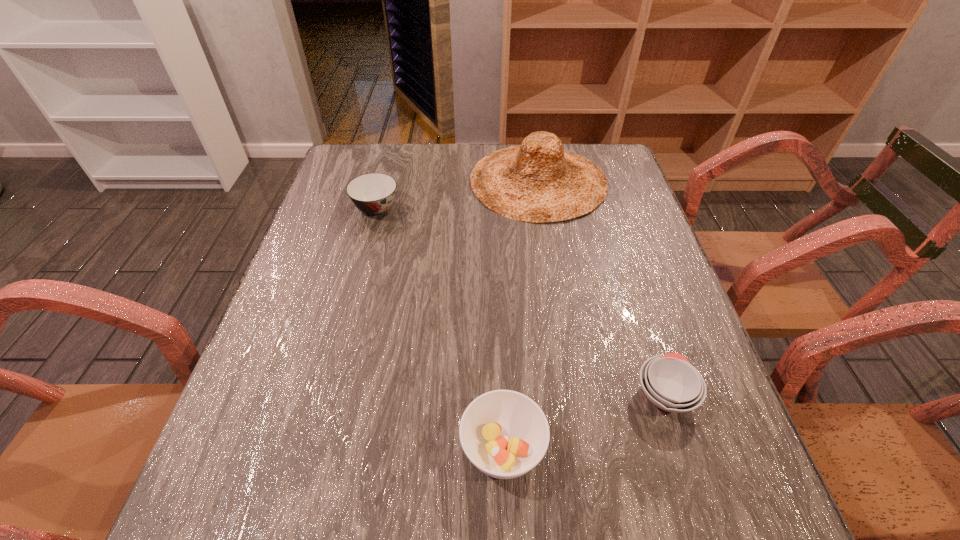
Locate an element on the screen. vacant space that's between the shortest object and the tallest object is located at coordinates click(601, 287).

Find the location of a particular element. free space between the second soup bowl from left to right and the shortest object is located at coordinates (584, 421).

At what (x,y) coordinates should I click in order to perform the action: click on blank region between the second soup bowl from left to right and the sunhat. Please return your answer as a coordinate pair (x, y). This screenshot has width=960, height=540. Looking at the image, I should click on [x=520, y=315].

Identify which object is the nearest to the rightmost soup bowl. Please provide its 2D coordinates. Your answer should be formatted as a tuple, i.e. [(x, y)], where the tuple contains the x and y coordinates of a point satisfying the conditions above.

[(505, 434)]

Identify which object is the second nearest to the rightmost soup bowl. Please provide its 2D coordinates. Your answer should be formatted as a tuple, i.e. [(x, y)], where the tuple contains the x and y coordinates of a point satisfying the conditions above.

[(537, 181)]

Locate which soup bowl ranks in proximity to the farthest soup bowl. Please provide its 2D coordinates. Your answer should be formatted as a tuple, i.e. [(x, y)], where the tuple contains the x and y coordinates of a point satisfying the conditions above.

[(505, 434)]

This screenshot has width=960, height=540. I want to click on soup bowl that stands as the closest to the sunhat, so click(x=373, y=193).

This screenshot has height=540, width=960. In order to click on free spot that satisfies the following two spatial constraints: 1. on the back side of the tallest object; 2. on the right side of the second soup bowl from left to right in this screenshot , I will do `click(493, 181)`.

Find the location of a particular element. vacant point that satisfies the following two spatial constraints: 1. on the back side of the sunhat; 2. on the left side of the second soup bowl from left to right is located at coordinates 493,181.

Locate an element on the screen. Image resolution: width=960 pixels, height=540 pixels. free point that satisfies the following two spatial constraints: 1. on the front side of the leftmost object; 2. on the right side of the shortest soup bowl is located at coordinates (326, 394).